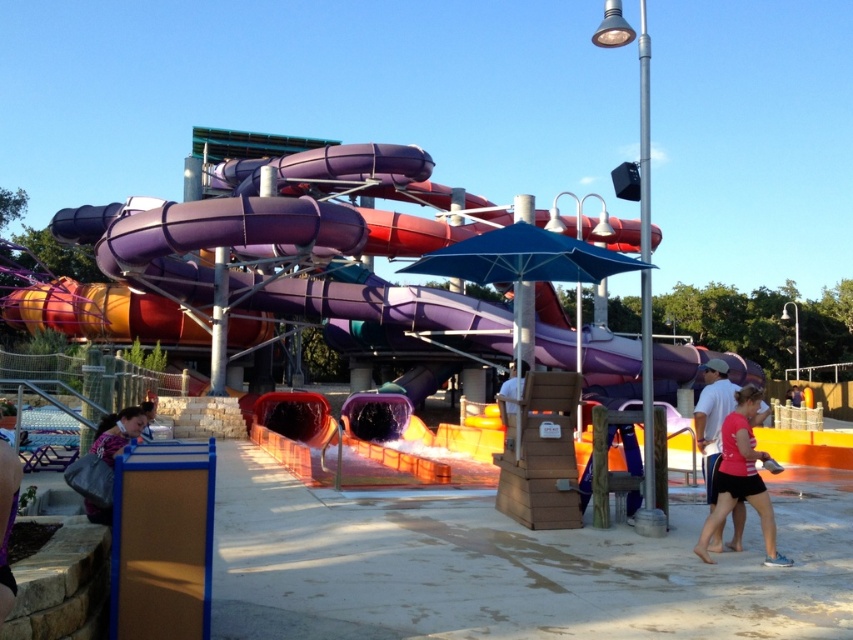
Locate an element on the screen. The height and width of the screenshot is (640, 853). pink fabric shorts at lower right is located at coordinates tap(740, 477).

Who is more distant from viewer, (759, 499) or (763, 416)?

The point (763, 416) is behind.

Is point (709, 536) more distant than point (711, 392)?

That is False.

Locate an element on the screen. The width and height of the screenshot is (853, 640). pink fabric shorts at lower right is located at coordinates (740, 477).

Is pink fabric shorts at lower right shorter than floral fabric bag at lower left?

No.

Who is positioned more to the right, pink fabric shorts at lower right or floral fabric bag at lower left?

From the viewer's perspective, pink fabric shorts at lower right appears more on the right side.

Which is in front, point (769, 497) or point (107, 448)?

Point (107, 448) is more forward.

Find the location of a particular element. pink fabric shorts at lower right is located at coordinates (740, 477).

Which is below, pink fabric shirt at lower right or floral fabric bag at lower left?

floral fabric bag at lower left is lower down.

Between point (717, 378) and point (108, 520), which one is positioned behind?

Positioned behind is point (717, 378).

Identify the location of pink fabric shirt at lower right. The image size is (853, 640). (712, 420).